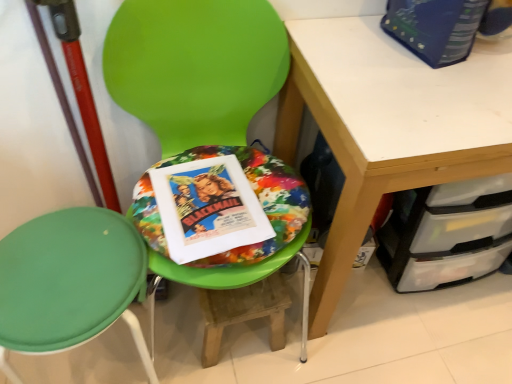
Question: From a real-world perspective, is green plastic chair at center, which is the first chair from right to left, on top of wooden step stool at center?

Choices:
 (A) yes
 (B) no

Answer: (A)

Question: Can you confirm if green plastic chair at center, which appears as the 2th chair when viewed from the left, is taller than wooden step stool at center?

Choices:
 (A) no
 (B) yes

Answer: (B)

Question: Can you confirm if green plastic chair at center, which appears as the 2th chair when viewed from the left, is smaller than wooden step stool at center?

Choices:
 (A) yes
 (B) no

Answer: (B)

Question: Can you see green plastic chair at center, which appears as the 2th chair when viewed from the left, touching wooden step stool at center?

Choices:
 (A) no
 (B) yes

Answer: (A)

Question: Does green plastic chair at center, which appears as the 2th chair when viewed from the left, have a larger size compared to wooden step stool at center?

Choices:
 (A) yes
 (B) no

Answer: (A)

Question: From the image's perspective, relative to wooden step stool at center, is blue cardboard book at upper right, which ranks as the second paperback book in left-to-right order, above or below?

Choices:
 (A) below
 (B) above

Answer: (B)

Question: From a real-world perspective, is blue cardboard book at upper right, the second paperback book when ordered from bottom to top, physically located above or below wooden step stool at center?

Choices:
 (A) above
 (B) below

Answer: (A)

Question: In terms of height, does blue cardboard book at upper right, the second paperback book when ordered from bottom to top, look taller or shorter compared to wooden step stool at center?

Choices:
 (A) short
 (B) tall

Answer: (A)

Question: In the image, is blue cardboard book at upper right, which ranks as the second paperback book in left-to-right order, positioned in front of or behind wooden step stool at center?

Choices:
 (A) behind
 (B) front

Answer: (B)

Question: Considering their positions, is matte paper movie poster at center, the 2th paperback book viewed from the top, located in front of or behind green plastic chair at center, which is the first chair from right to left?

Choices:
 (A) front
 (B) behind

Answer: (B)

Question: Looking at their shapes, would you say matte paper movie poster at center, the 2th paperback book from the right, is wider or thinner than green plastic chair at center, which is the first chair from right to left?

Choices:
 (A) wide
 (B) thin

Answer: (B)

Question: Does point pyautogui.click(x=188, y=254) appear closer or farther from the camera than point pyautogui.click(x=242, y=54)?

Choices:
 (A) closer
 (B) farther

Answer: (A)

Question: Visually, is matte paper movie poster at center, the 1th paperback book positioned from the bottom, positioned to the left or to the right of green plastic chair at center, which is the first chair from right to left?

Choices:
 (A) left
 (B) right

Answer: (A)

Question: From a real-world perspective, relative to matte paper movie poster at center, the 2th paperback book from the right, is green plastic chair at center, which is the first chair from right to left, vertically above or below?

Choices:
 (A) below
 (B) above

Answer: (A)

Question: Is green plastic chair at center, which appears as the 2th chair when viewed from the left, taller or shorter than matte paper movie poster at center, the 2th paperback book viewed from the top?

Choices:
 (A) tall
 (B) short

Answer: (A)